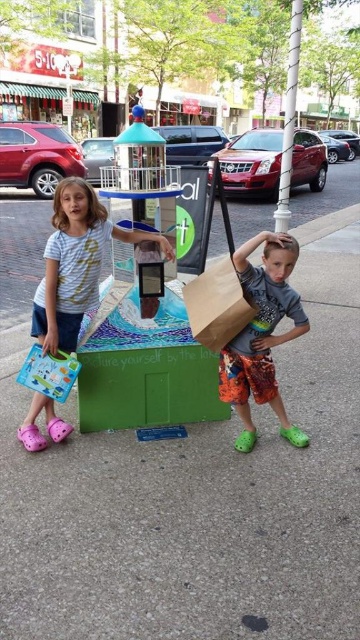
Question: Does matte white shirt at left appear over matte gray shirt at center?

Choices:
 (A) no
 (B) yes

Answer: (B)

Question: Which of these objects is positioned closest to the matte gray shirt at center?

Choices:
 (A) brown paper bag at center
 (B) matte white shirt at left

Answer: (A)

Question: Which of the following is the closest to the observer?

Choices:
 (A) matte white shirt at left
 (B) brown paper bag at center

Answer: (B)

Question: Is matte gray shirt at center to the right of brown paper bag at center from the viewer's perspective?

Choices:
 (A) no
 (B) yes

Answer: (B)

Question: Is matte gray shirt at center bigger than brown paper bag at center?

Choices:
 (A) no
 (B) yes

Answer: (B)

Question: Estimate the real-world distances between objects in this image. Which object is farther from the brown paper bag at center?

Choices:
 (A) matte gray shirt at center
 (B) matte white shirt at left

Answer: (B)